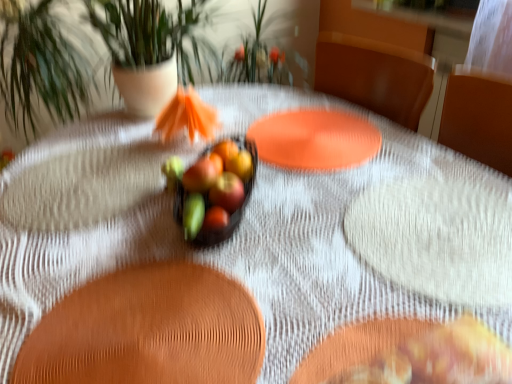
Locate an element on the screen. The image size is (512, 384). vacant region in front of glossy ceramic grapefruit at center is located at coordinates (296, 276).